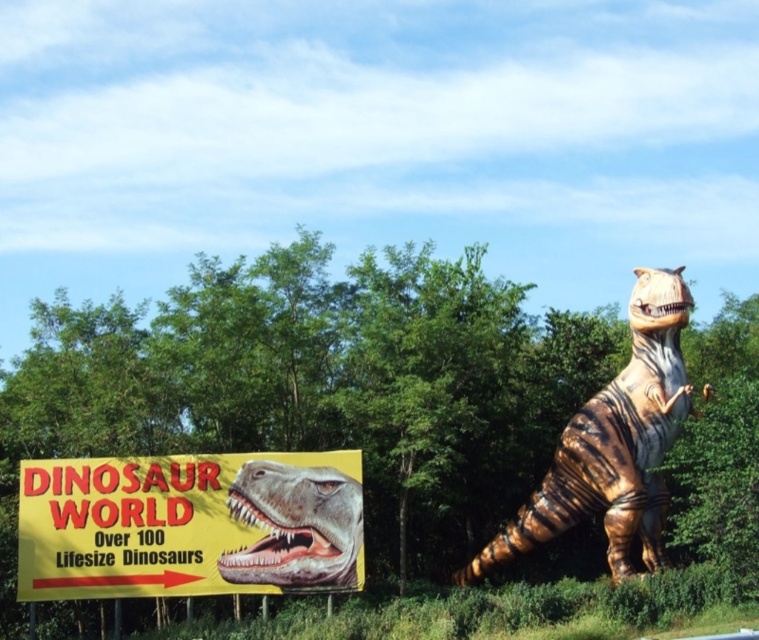
You are a visitor at the Dinosaur World exhibit and want to take a photo of both the yellow paper sign at lower left and the shiny metallic dinosaur head at center. Since you can only focus on one object at a time, which object should you focus on to ensure the other is still in the background?

You should focus on the yellow paper sign at lower left because it is closer to the viewer, allowing the shiny metallic dinosaur head at center to remain in the background while still in focus.

From the picture: You are a visitor at the park and see the yellow paper sign at lower left and the striped metallic dinosaur at center. Which object is larger?

The striped metallic dinosaur at center is larger than the yellow paper sign at lower left.